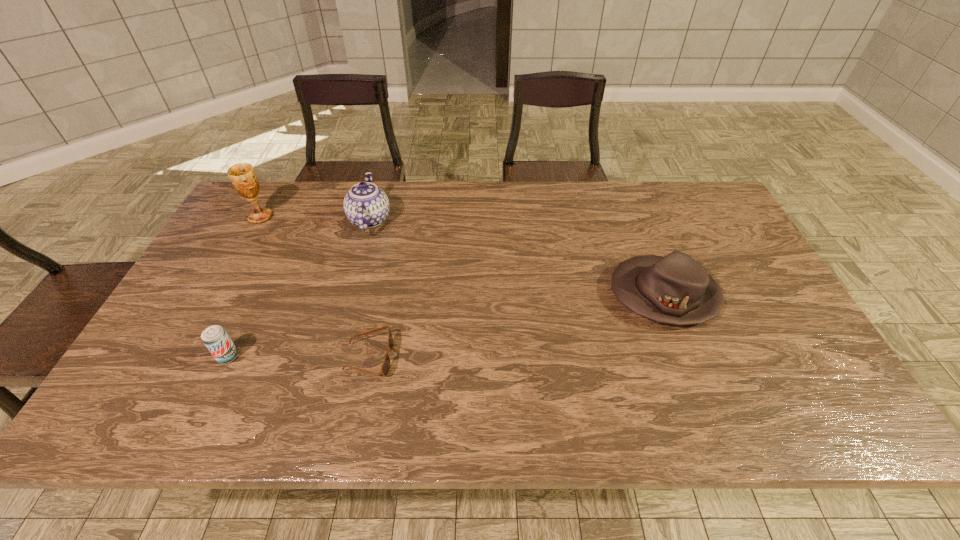
Locate an element on the screen. chalice is located at coordinates (243, 177).

At what (x,y) coordinates should I click in order to perform the action: click on the tallest object. Please return your answer as a coordinate pair (x, y). This screenshot has height=540, width=960. Looking at the image, I should click on (243, 177).

Locate an element on the screen. The width and height of the screenshot is (960, 540). chinaware is located at coordinates (366, 205).

This screenshot has width=960, height=540. I want to click on the third farthest object, so click(675, 289).

The height and width of the screenshot is (540, 960). I want to click on hat, so click(x=675, y=289).

You are a GUI agent. You are given a task and a screenshot of the screen. Output one action in this format:
    pyautogui.click(x=<x>, y=<y>)
    Task: Click on the beer can
    This screenshot has width=960, height=540.
    Given the screenshot: What is the action you would take?
    pyautogui.click(x=215, y=338)

Where is `sunglasses`? sunglasses is located at coordinates (385, 368).

This screenshot has width=960, height=540. I want to click on vacant space located on the front of the leftmost object, so click(x=245, y=246).

Identify the location of free space located 0.400m at the spout of the chinaware. This screenshot has width=960, height=540. (517, 220).

This screenshot has width=960, height=540. In order to click on vacant space located on the decorative side of the third nearest object in this screenshot , I will do `click(541, 295)`.